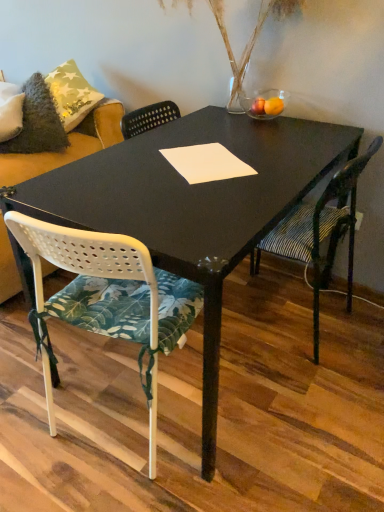
Question: From the image's perspective, is white paper at center positioned above or below striped fabric chair at right, which appears as the 1th chair when viewed from the right?

Choices:
 (A) above
 (B) below

Answer: (A)

Question: Considering the positions of white paper at center and striped fabric chair at right, the second chair when ordered from left to right, in the image, is white paper at center taller or shorter than striped fabric chair at right, the second chair when ordered from left to right,?

Choices:
 (A) short
 (B) tall

Answer: (A)

Question: Estimate the real-world distances between objects in this image. Which object is farther from the striped fabric chair at right, the second chair when ordered from left to right?

Choices:
 (A) white perforated plastic chair at center, which is counted as the 2th chair, starting from the right
 (B) fuzzy gray pillow at upper left
 (C) translucent glass vase at upper center
 (D) white paper at center

Answer: (B)

Question: Which is farther from the fuzzy gray pillow at upper left?

Choices:
 (A) translucent glass vase at upper center
 (B) white paper at center
 (C) striped fabric chair at right, the second chair when ordered from left to right
 (D) white perforated plastic chair at center, which is the 1th chair from left to right

Answer: (C)